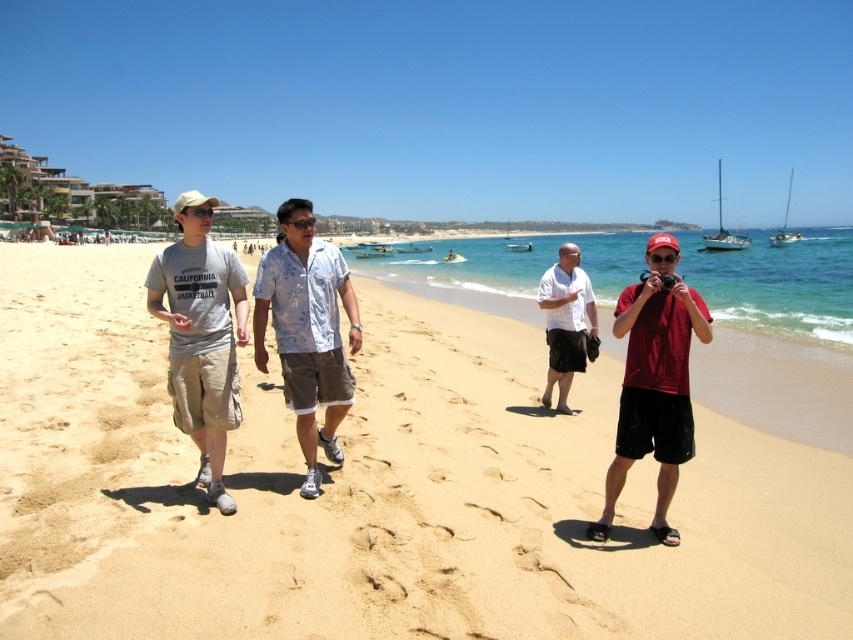
In the scene shown: You are a photographer trying to capture a group photo of the two people at the center of the beach scene. The floral fabric shirt at center and the white cotton shirt at center are both in your frame. If you want to make sure both shirts are clearly visible in the photo, which shirt should you focus on first?

The floral fabric shirt at center has a smaller size compared to the white cotton shirt at center, so you should focus on the floral fabric shirt at center first to ensure its details are clear.

You are trying to decide which shirt to wear for a beach day. The floral fabric shirt at center and the white cotton shirt at center are both options. Based on the image, which shirt is narrower in width?

The floral fabric shirt at center is narrower in width compared to the white cotton shirt at center.